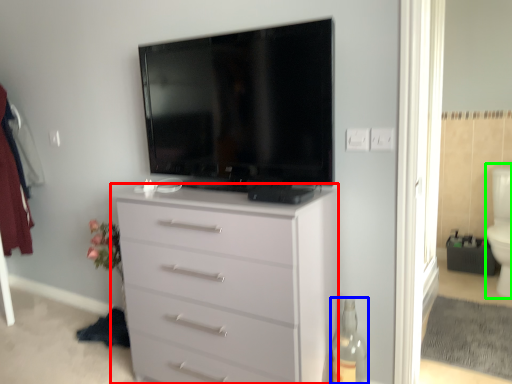
Question: Estimate the real-world distances between objects in this image. Which object is closer to chest of drawers (highlighted by a red box), bottle (highlighted by a blue box) or toilet bowl (highlighted by a green box)?

Choices:
 (A) bottle
 (B) toilet bowl

Answer: (A)